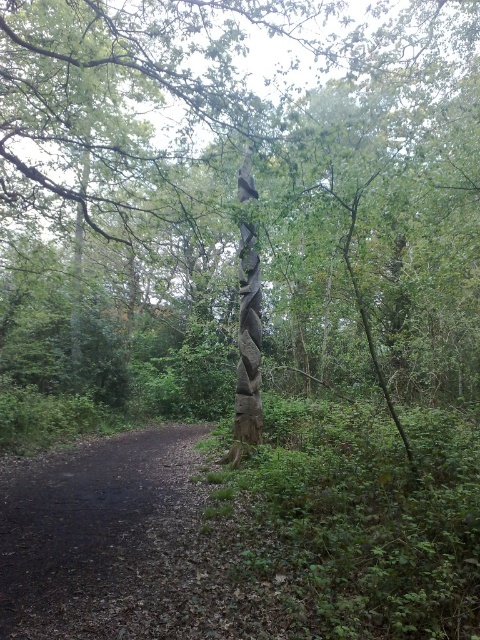
Question: Is carved wooden totem pole at center positioned before dirt/gravel path at lower left?

Choices:
 (A) no
 (B) yes

Answer: (A)

Question: Can you confirm if carved wooden totem pole at center is smaller than dirt/gravel path at lower left?

Choices:
 (A) no
 (B) yes

Answer: (A)

Question: Based on their relative distances, which object is farther from the carved wooden totem pole at center?

Choices:
 (A) dirt/gravel path at lower left
 (B) carved wood totem pole at center

Answer: (A)

Question: Does carved wooden totem pole at center appear under carved wood totem pole at center?

Choices:
 (A) no
 (B) yes

Answer: (A)

Question: Which object appears farthest from the camera in this image?

Choices:
 (A) carved wooden totem pole at center
 (B) carved wood totem pole at center

Answer: (B)

Question: Which point is farther from the camera taking this photo?

Choices:
 (A) (456, 22)
 (B) (240, 269)

Answer: (A)